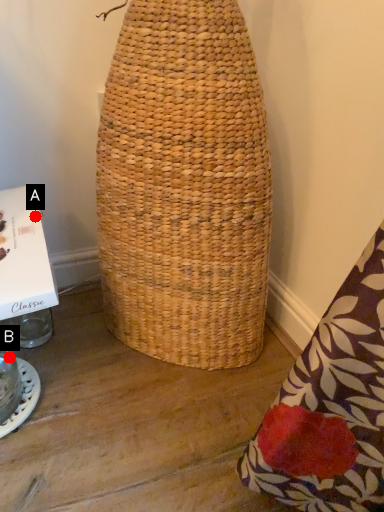
Question: Two points are circled on the image, labeled by A and B beside each circle. Among these points, which one is farthest from the camera?

Choices:
 (A) A is further
 (B) B is further

Answer: (B)